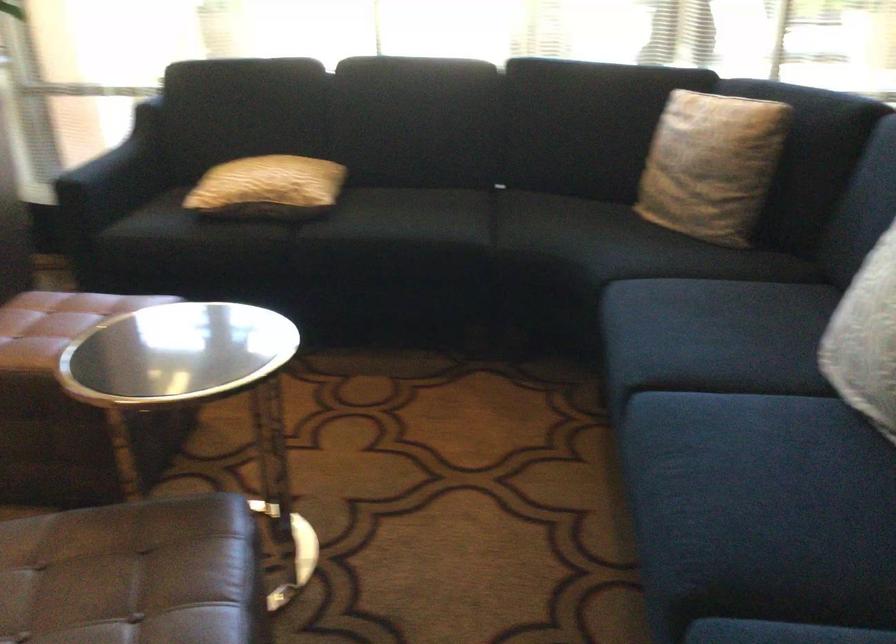
Find where to resting arm the dark sofa armrest. Please return your answer as a coordinate pair (x, y).

(115, 176)